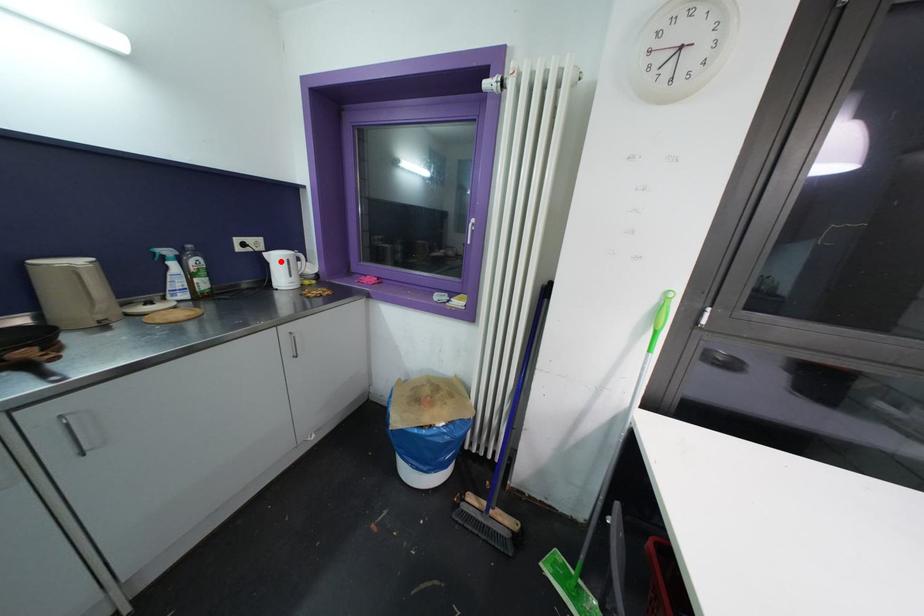
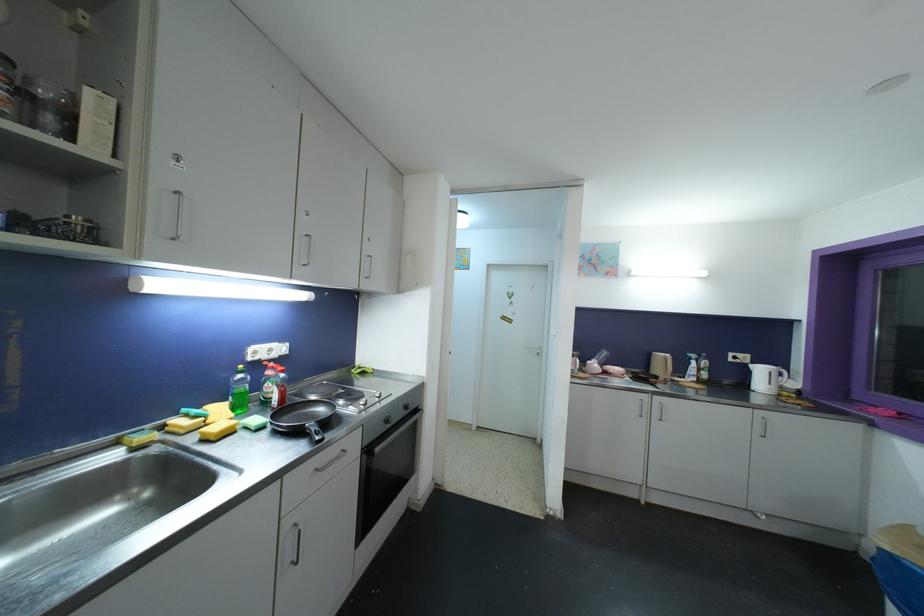
Locate, in the second image, the point that corresponds to the highlighted location in the first image.

(763, 373)